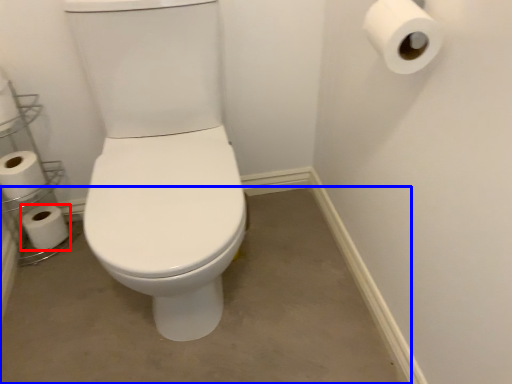
Question: Among these objects, which one is nearest to the camera, toilet paper (highlighted by a red box) or concrete (highlighted by a blue box)?

Choices:
 (A) toilet paper
 (B) concrete

Answer: (B)